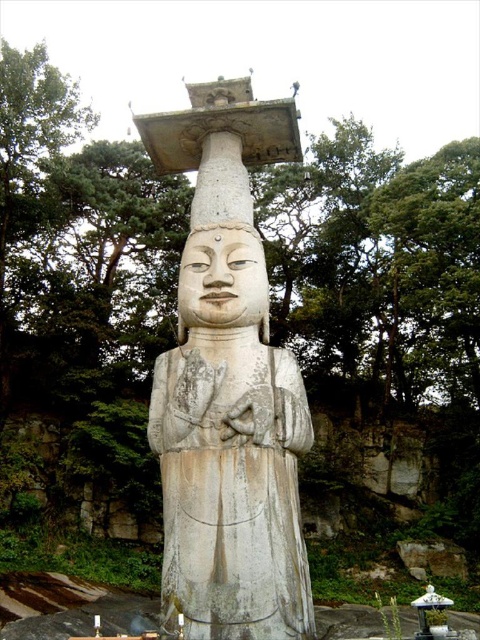
You are a photographer planning to take a photo of the white stone statue at center and the white stone head at center. However, you notice that one of them is blocking the view of the other. Which object is being blocked by the other?

The white stone statue at center is positioned under the white stone head at center, so the statue is blocking the view of the head.

You are a tour guide explaining the statue to visitors. You want to mention the distance between the white stone statue at center and the white stone head at center. What should you say?

The white stone head at center is part of the white stone statue at center, so they are the same object. The distance between them is 2.90 meters, which indicates that the statue is 2.90 meters tall.

You are standing at a point where you can see the statue and the surrounding area. If you want to move 5 meters closer to the statue, will you be able to reach the point marked at coordinates point (x=200, y=433)? Please explain your reasoning.

The distance between you and the point marked at coordinates point (x=200, y=433) is 13.37 meters. Moving 5 meters closer would leave you 8.37 meters away from the point, so you would not reach it yet.